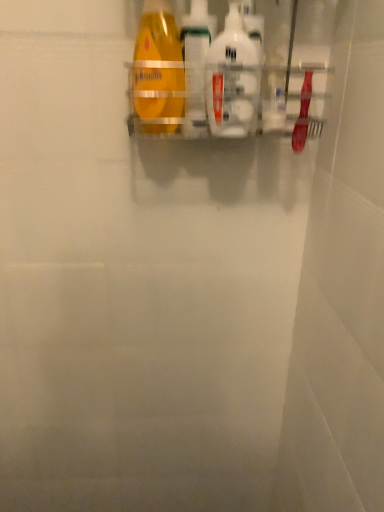
Question: Which direction should I rotate to look at translucent plastic bottle at center, which is the second cleaning product in right-to-left order, — up or down?

Choices:
 (A) down
 (B) up

Answer: (B)

Question: Is white glossy bottle at center, which appears as the 1th cleaning product when viewed from the right, with yellow matte bottle at upper center?

Choices:
 (A) no
 (B) yes

Answer: (B)

Question: Is yellow matte bottle at upper center surrounded by white glossy bottle at center, which appears as the 1th cleaning product when viewed from the right?

Choices:
 (A) yes
 (B) no

Answer: (B)

Question: Is white glossy bottle at center, which appears as the 1th cleaning product when viewed from the right, not within yellow matte bottle at upper center?

Choices:
 (A) yes
 (B) no

Answer: (A)

Question: Can you confirm if white glossy bottle at center, which appears as the 1th cleaning product when viewed from the right, is taller than yellow matte bottle at upper center?

Choices:
 (A) no
 (B) yes

Answer: (A)

Question: Does white glossy bottle at center, the second cleaning product in the left-to-right sequence, have a lesser width compared to yellow matte bottle at upper center?

Choices:
 (A) yes
 (B) no

Answer: (A)

Question: Is white glossy bottle at center, which appears as the 1th cleaning product when viewed from the right, positioned behind yellow matte bottle at upper center?

Choices:
 (A) yes
 (B) no

Answer: (A)

Question: From a real-world perspective, does yellow matte bottle at upper center stand above white glossy bottle at center, the second cleaning product in the left-to-right sequence?

Choices:
 (A) no
 (B) yes

Answer: (B)

Question: Is yellow matte bottle at upper center at the left side of white glossy bottle at center, the second cleaning product in the left-to-right sequence?

Choices:
 (A) yes
 (B) no

Answer: (A)

Question: Is yellow matte bottle at upper center not inside white glossy bottle at center, which appears as the 1th cleaning product when viewed from the right?

Choices:
 (A) no
 (B) yes

Answer: (B)

Question: Does yellow matte bottle at upper center touch white glossy bottle at center, the second cleaning product in the left-to-right sequence?

Choices:
 (A) no
 (B) yes

Answer: (B)

Question: Does yellow matte bottle at upper center have a lesser height compared to white glossy bottle at center, the second cleaning product in the left-to-right sequence?

Choices:
 (A) no
 (B) yes

Answer: (A)

Question: From the image's perspective, is yellow matte bottle at upper center located above white glossy bottle at center, which appears as the 1th cleaning product when viewed from the right?

Choices:
 (A) yes
 (B) no

Answer: (A)

Question: Does translucent plastic bottle at center, which is the second cleaning product in right-to-left order, have a lesser height compared to white glossy bottle at center, which appears as the 1th cleaning product when viewed from the right?

Choices:
 (A) yes
 (B) no

Answer: (B)